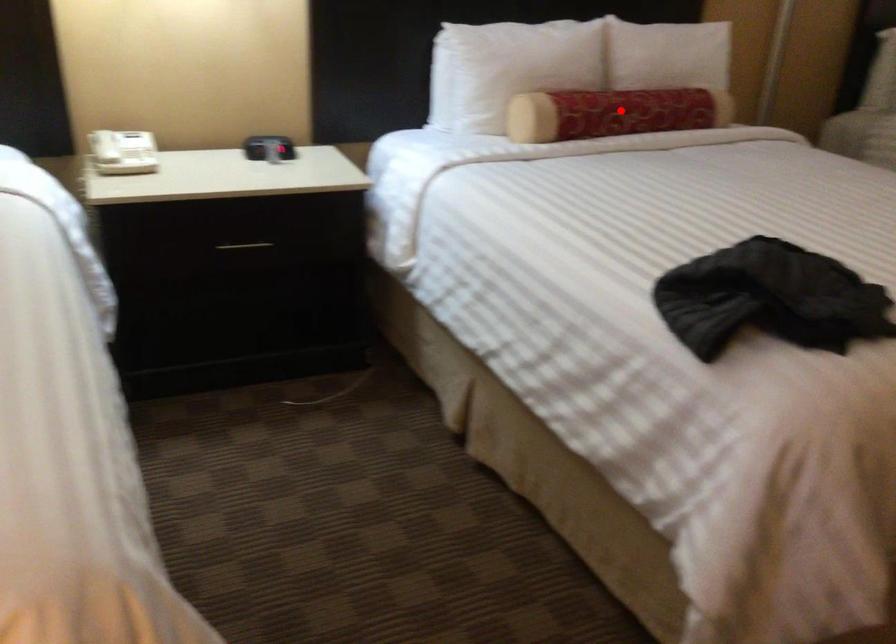
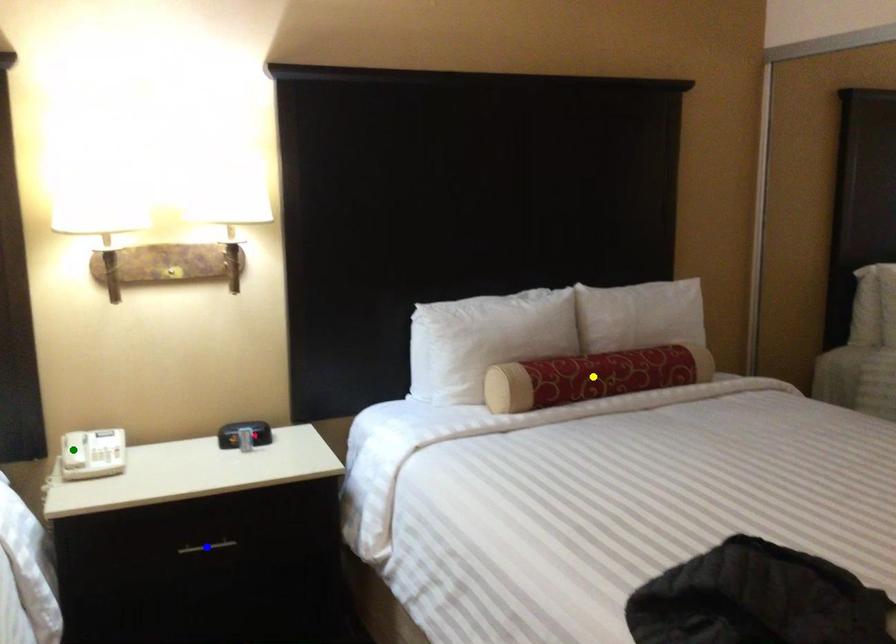
Question: I am providing you with two images of the same scene from different viewpoints. A red point is marked on the first image. You are given multiple points on the second image. Which point in image 2 is actually the same real-world point as the red point in image 1?

Choices:
 (A) green point
 (B) yellow point
 (C) blue point

Answer: (B)